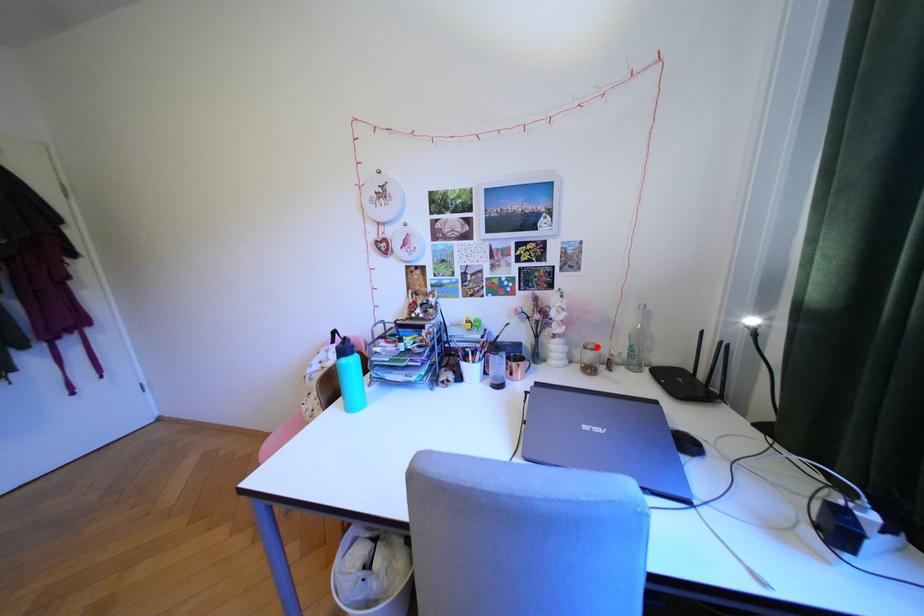
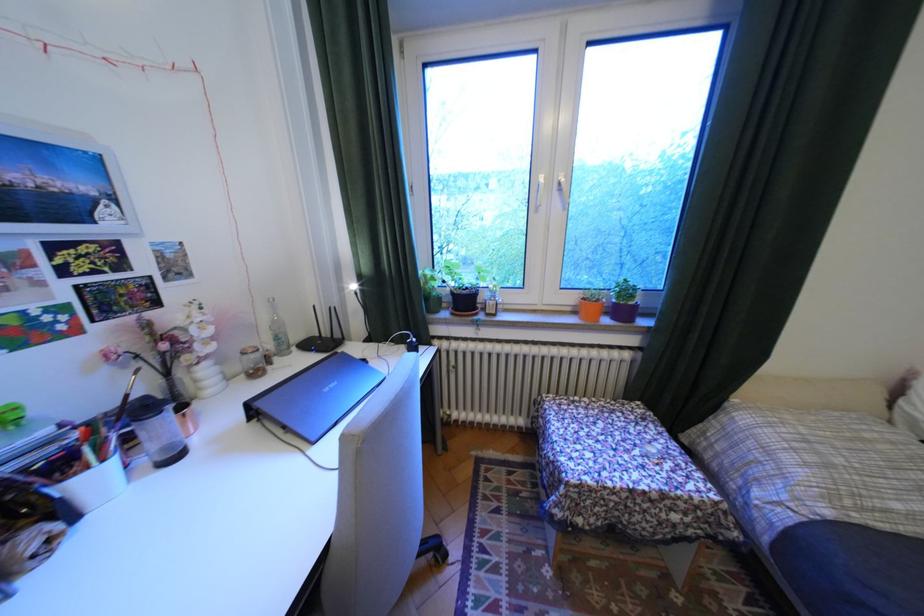
Find the pixel in the second image that matches the highlighted location in the first image.

(254, 354)